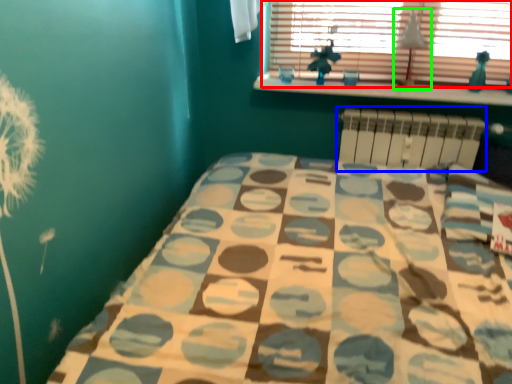
Question: Considering the real-world distances, which object is farthest from window (highlighted by a red box)? radiator (highlighted by a blue box) or lamp (highlighted by a green box)?

Choices:
 (A) radiator
 (B) lamp

Answer: (A)